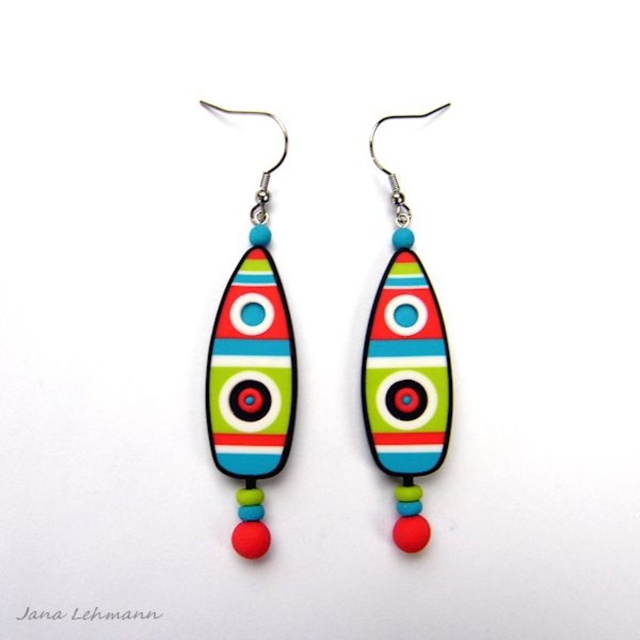
Question: Does matte plastic earring at left have a smaller size compared to matte plastic earring at center?

Choices:
 (A) yes
 (B) no

Answer: (B)

Question: Is matte plastic earring at left behind matte plastic earring at center?

Choices:
 (A) yes
 (B) no

Answer: (B)

Question: Does matte plastic earring at left have a smaller size compared to matte plastic earring at center?

Choices:
 (A) yes
 (B) no

Answer: (B)